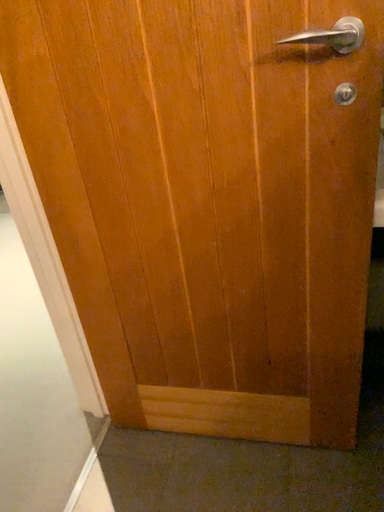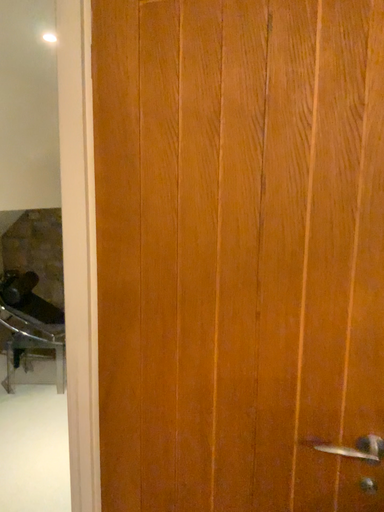
Question: Which way did the camera rotate in the video?

Choices:
 (A) rotated upward
 (B) rotated downward

Answer: (A)